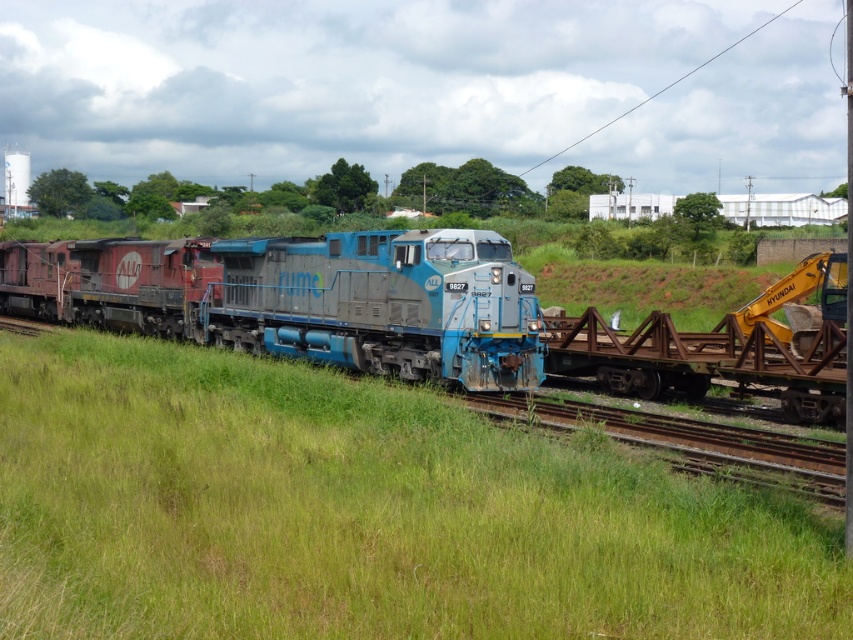
Is point (277, 336) farther from camera compared to point (642, 337)?

Yes, it is behind point (642, 337).

Between blue metallic train at center and rusty metal rail at right, which one is positioned higher?

Positioned higher is blue metallic train at center.

Describe the element at coordinates (303, 298) in the screenshot. I see `blue metallic train at center` at that location.

Locate an element on the screen. The width and height of the screenshot is (853, 640). blue metallic train at center is located at coordinates (303, 298).

Which is in front, point (252, 573) or point (491, 250)?

Point (252, 573)

What do you see at coordinates (363, 513) in the screenshot? I see `green grassy at center` at bounding box center [363, 513].

Locate an element on the screen. The height and width of the screenshot is (640, 853). green grassy at center is located at coordinates (363, 513).

This screenshot has width=853, height=640. What are the coordinates of `green grassy at center` in the screenshot? It's located at (363, 513).

Is green grassy at center below rusty metal rail at right?

Indeed, green grassy at center is positioned under rusty metal rail at right.

What are the coordinates of `green grassy at center` in the screenshot? It's located at (363, 513).

Does point (329, 477) come closer to viewer compared to point (608, 388)?

Yes, point (329, 477) is closer to viewer.

This screenshot has width=853, height=640. I want to click on green grassy at center, so click(x=363, y=513).